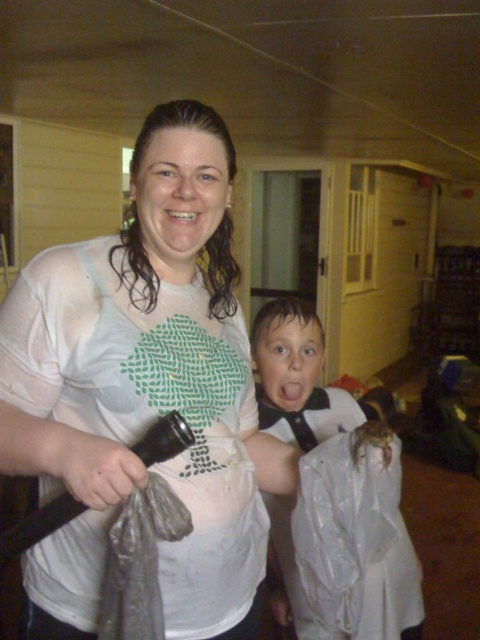
Question: Which of the following is the farthest from the observer?

Choices:
 (A) (298, 316)
 (B) (112, 436)

Answer: (A)

Question: Which point appears closest to the camera in this image?

Choices:
 (A) (168, 168)
 (B) (252, 348)

Answer: (A)

Question: Which point is farther to the camera?

Choices:
 (A) white matte t-shirt at center
 (B) white plastic bag at center

Answer: (B)

Question: Is white matte t-shirt at center bigger than white plastic bag at center?

Choices:
 (A) yes
 (B) no

Answer: (B)

Question: Is white matte t-shirt at center to the left of white plastic bag at center from the viewer's perspective?

Choices:
 (A) yes
 (B) no

Answer: (A)

Question: Is the position of white matte t-shirt at center more distant than that of white plastic bag at center?

Choices:
 (A) yes
 (B) no

Answer: (B)